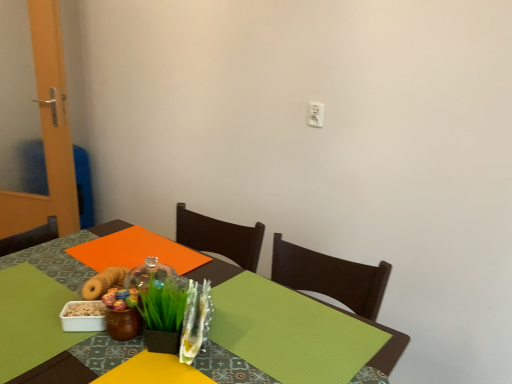
Question: In terms of width, does white plastic electric outlet at upper center look wider or thinner when compared to green leafy grass at center?

Choices:
 (A) thin
 (B) wide

Answer: (A)

Question: Looking at the image, does white plastic electric outlet at upper center seem bigger or smaller compared to green leafy grass at center?

Choices:
 (A) big
 (B) small

Answer: (B)

Question: Considering the real-world distances, which object is closest to the green leafy grass at center?

Choices:
 (A) white plastic electric outlet at upper center
 (B) green fabric table at center

Answer: (B)

Question: Which is nearer to the green leafy grass at center?

Choices:
 (A) white plastic electric outlet at upper center
 (B) green fabric table at center

Answer: (B)